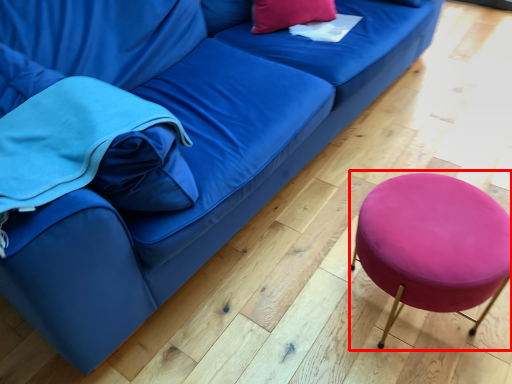
Question: Where is bar stool (annotated by the red box) located in relation to pillow in the image?

Choices:
 (A) left
 (B) right

Answer: (B)